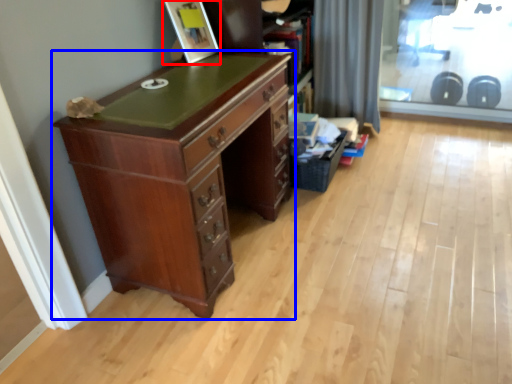
Question: Which point is further to the camera, picture frame (highlighted by a red box) or chest of drawers (highlighted by a blue box)?

Choices:
 (A) picture frame
 (B) chest of drawers

Answer: (A)